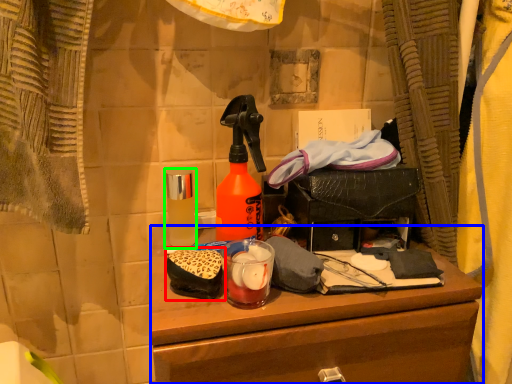
Question: Estimate the real-world distances between objects in this image. Which object is farther from debris (highlighted by a red box), desk (highlighted by a blue box) or bottle (highlighted by a green box)?

Choices:
 (A) desk
 (B) bottle

Answer: (A)